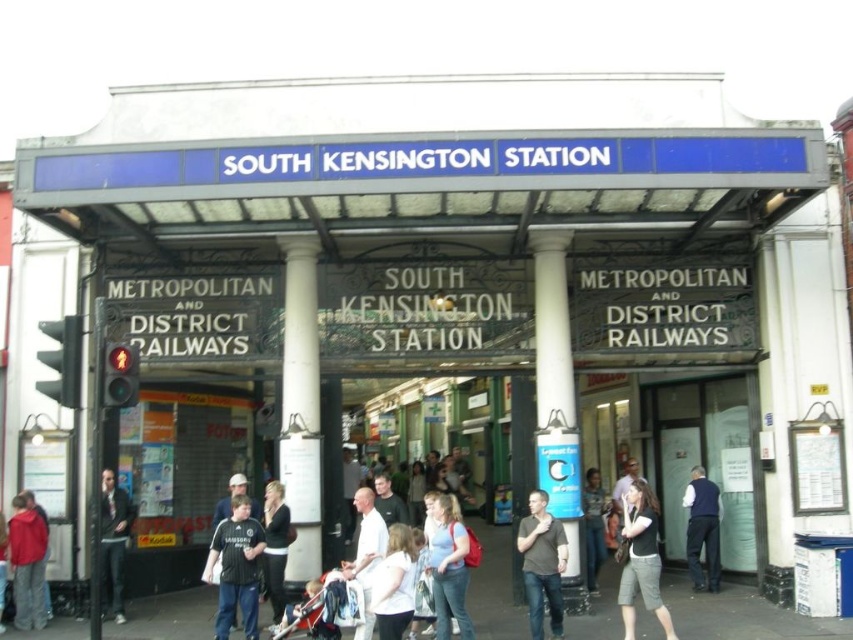
Can you confirm if transparent glass door at center is taller than light brown leather jacket at center?

Correct, transparent glass door at center is much taller as light brown leather jacket at center.

Measure the distance between transparent glass door at center and light brown leather jacket at center.

8.26 meters

Is point (686, 387) more distant than point (598, 502)?

Yes, it is.

This screenshot has height=640, width=853. What are the coordinates of `transparent glass door at center` in the screenshot? It's located at (704, 460).

Does light blue cotton shirt at center have a greater width compared to dark blue vest at lower right?

Yes.

Is light blue cotton shirt at center shorter than dark blue vest at lower right?

Yes.

Which is in front, point (454, 540) or point (694, 508)?

Positioned in front is point (454, 540).

You are a GUI agent. You are given a task and a screenshot of the screen. Output one action in this format:
    pyautogui.click(x=<x>, y=<y>)
    Task: Click on the light blue cotton shirt at center
    Image resolution: width=853 pixels, height=640 pixels.
    Given the screenshot: What is the action you would take?
    pyautogui.click(x=448, y=566)

Between dark blue vest at lower right and black fabric jacket at center, which one is positioned higher?

dark blue vest at lower right is above.

Is dark blue vest at lower right thinner than black fabric jacket at center?

No, dark blue vest at lower right is not thinner than black fabric jacket at center.

This screenshot has height=640, width=853. Describe the element at coordinates (701, 529) in the screenshot. I see `dark blue vest at lower right` at that location.

The height and width of the screenshot is (640, 853). Identify the location of dark blue vest at lower right. (701, 529).